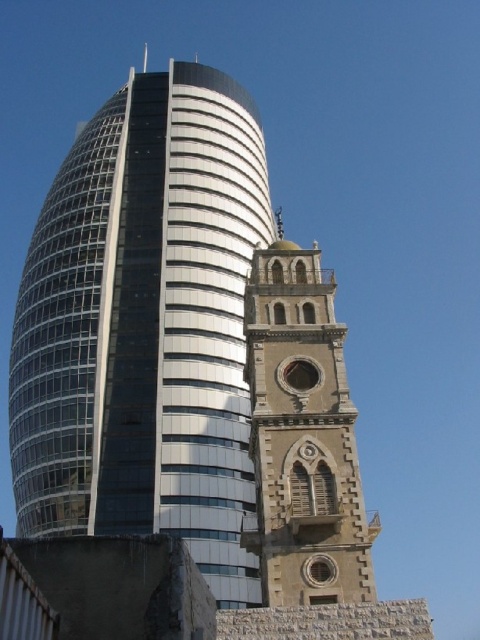
You are an architect analyzing the two bell towers in the image. Which of the two, the stone textured bell tower at center or the stone gothic bell tower at center, has a greater height?

The stone textured bell tower at center is much taller than the stone gothic bell tower at center according to the description provided.

Please look at the image and identify the object located at the coordinates point (144, 326). Based on the scene description, what is the object at that point?

The point (144, 326) marks the stone textured bell tower at center.

You are standing in front of the skyscraper and the older tower. You notice two points marked as point (166, 252) and point (266, 259). Which point is closer to your eyes?

Point (166, 252) is closer to your eyes because it is further to the camera than point (266, 259).